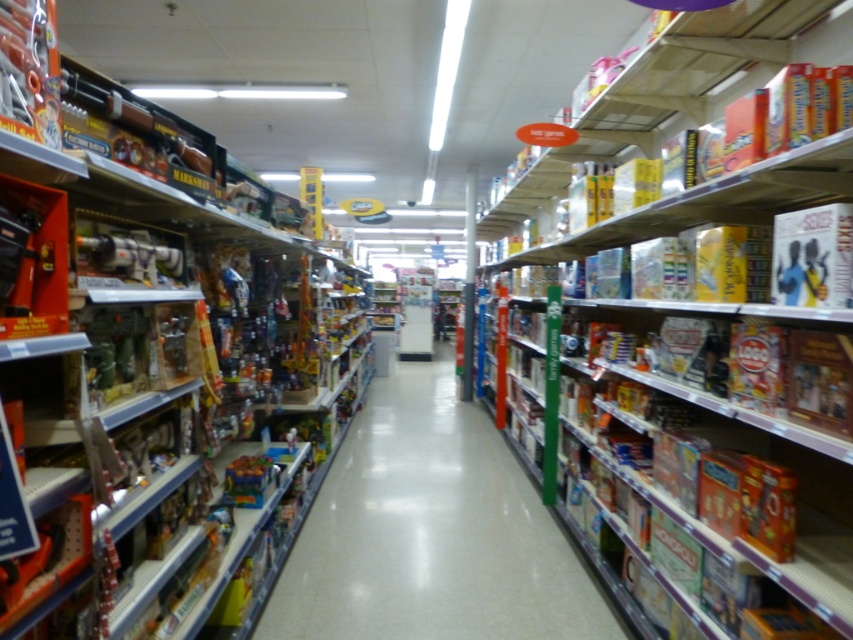
Question: Which point appears farthest from the camera in this image?

Choices:
 (A) (801, 321)
 (B) (502, 589)

Answer: (B)

Question: Can you confirm if cardboard game box at upper right is wider than matte plastic toys at center?

Choices:
 (A) yes
 (B) no

Answer: (A)

Question: Which object appears closest to the camera in this image?

Choices:
 (A) matte plastic toys at center
 (B) cardboard game box at upper right

Answer: (B)

Question: Where is cardboard game box at upper right located in relation to matte plastic toys at center in the image?

Choices:
 (A) above
 (B) below

Answer: (A)

Question: Observing the image, what is the correct spatial positioning of cardboard game box at upper right in reference to matte plastic toys at center?

Choices:
 (A) right
 (B) left

Answer: (A)

Question: Which of the following is the closest to the observer?

Choices:
 (A) cardboard game box at upper right
 (B) matte plastic toys at center

Answer: (A)